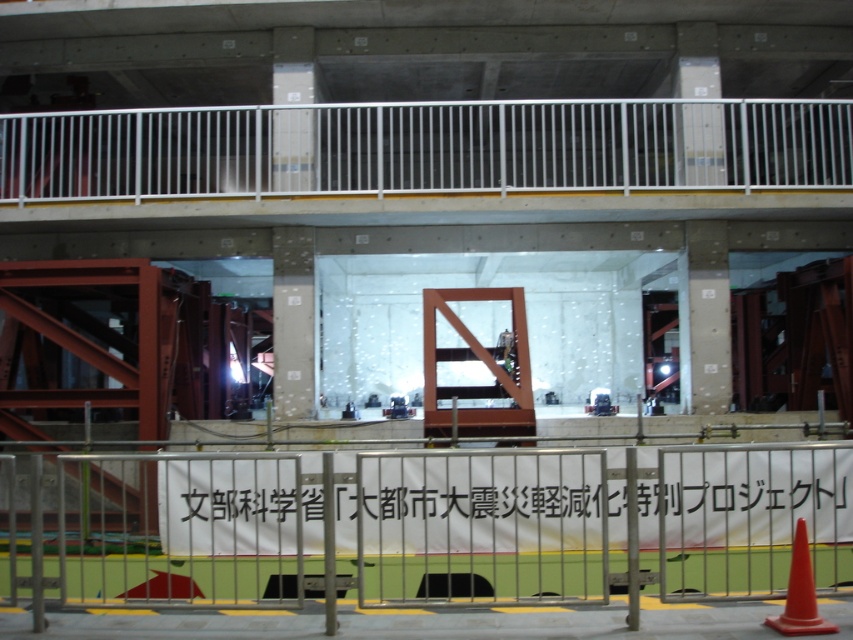
Is silver metallic fence at lower center further to camera compared to orange matte traffic cone at lower right?

Yes, it is.

Does silver metallic fence at lower center have a smaller size compared to orange matte traffic cone at lower right?

Actually, silver metallic fence at lower center might be larger than orange matte traffic cone at lower right.

Which is behind, point (45, 481) or point (791, 612)?

The point (45, 481) is behind.

I want to click on silver metallic fence at lower center, so click(433, 524).

Which is in front, point (703, 586) or point (717, 496)?

Point (703, 586) is in front.

From the picture: Which is more to the right, silver metallic fence at lower center or white paper banner at center?

white paper banner at center

Image resolution: width=853 pixels, height=640 pixels. In order to click on silver metallic fence at lower center in this screenshot , I will do `click(433, 524)`.

Is point (746, 481) closer to camera compared to point (804, 586)?

No.

Where is `white paper banner at center`? The height and width of the screenshot is (640, 853). white paper banner at center is located at coordinates (749, 499).